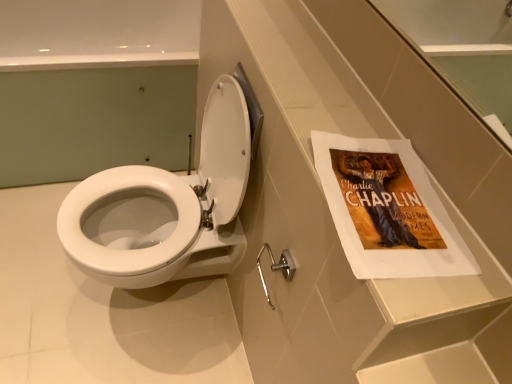
Question: Is white glossy toilet at center located outside white glossy toilet at center?

Choices:
 (A) yes
 (B) no

Answer: (A)

Question: Would you say white glossy toilet at center is part of white glossy toilet at center's contents?

Choices:
 (A) yes
 (B) no

Answer: (B)

Question: Does white glossy toilet at center turn towards white glossy toilet at center?

Choices:
 (A) no
 (B) yes

Answer: (B)

Question: Does white glossy toilet at center come in front of white glossy toilet at center?

Choices:
 (A) no
 (B) yes

Answer: (A)

Question: Is white glossy toilet at center touching white glossy toilet at center?

Choices:
 (A) no
 (B) yes

Answer: (A)

Question: From a real-world perspective, relative to silver metallic towel bar at lower center, is white glossy toilet at center vertically above or below?

Choices:
 (A) above
 (B) below

Answer: (B)

Question: Is white glossy toilet at center to the left or to the right of silver metallic towel bar at lower center in the image?

Choices:
 (A) right
 (B) left

Answer: (B)

Question: In terms of width, does white glossy toilet at center look wider or thinner when compared to silver metallic towel bar at lower center?

Choices:
 (A) thin
 (B) wide

Answer: (B)

Question: From the image's perspective, relative to silver metallic towel bar at lower center, is white glossy toilet at center above or below?

Choices:
 (A) above
 (B) below

Answer: (A)

Question: Based on their positions, is white glossy toilet at center located to the left or right of white glossy toilet at center?

Choices:
 (A) right
 (B) left

Answer: (A)

Question: In terms of width, does white glossy toilet at center look wider or thinner when compared to white glossy toilet at center?

Choices:
 (A) thin
 (B) wide

Answer: (A)

Question: Is point coord(219,198) closer or farther from the camera than point coord(189,102)?

Choices:
 (A) farther
 (B) closer

Answer: (B)

Question: Considering the positions of white glossy toilet at center and white glossy toilet at center in the image, is white glossy toilet at center bigger or smaller than white glossy toilet at center?

Choices:
 (A) small
 (B) big

Answer: (A)

Question: From the image's perspective, relative to white glossy toilet at center, is silver metallic towel bar at lower center above or below?

Choices:
 (A) above
 (B) below

Answer: (B)

Question: Considering their positions, is silver metallic towel bar at lower center located in front of or behind white glossy toilet at center?

Choices:
 (A) behind
 (B) front

Answer: (B)